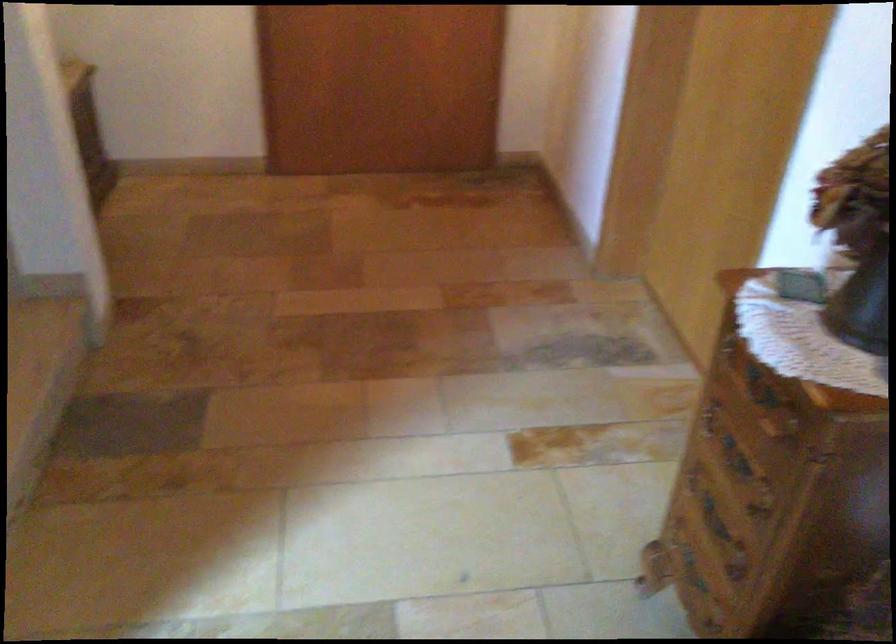
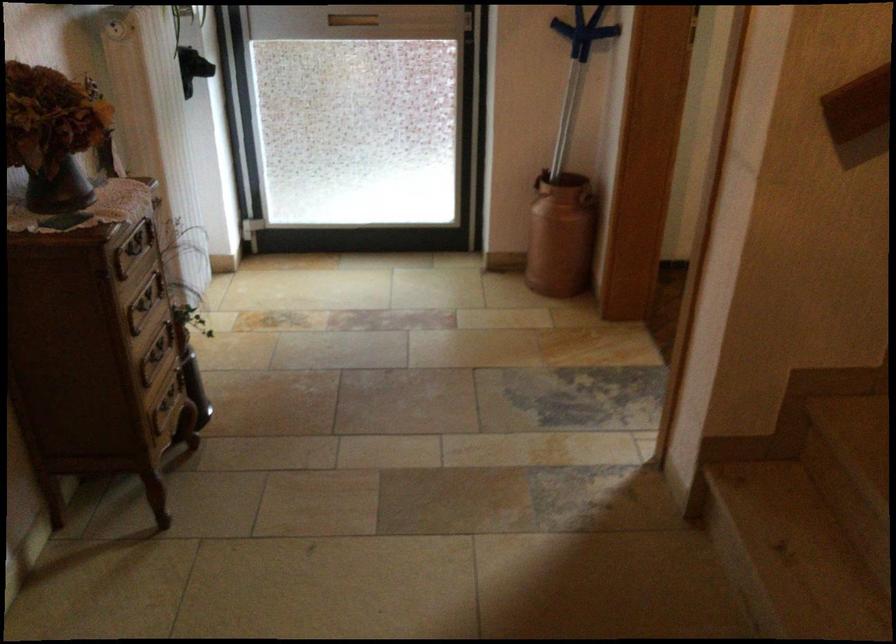
The point at (709, 576) is marked in the first image. Where is the corresponding point in the second image?

(167, 404)